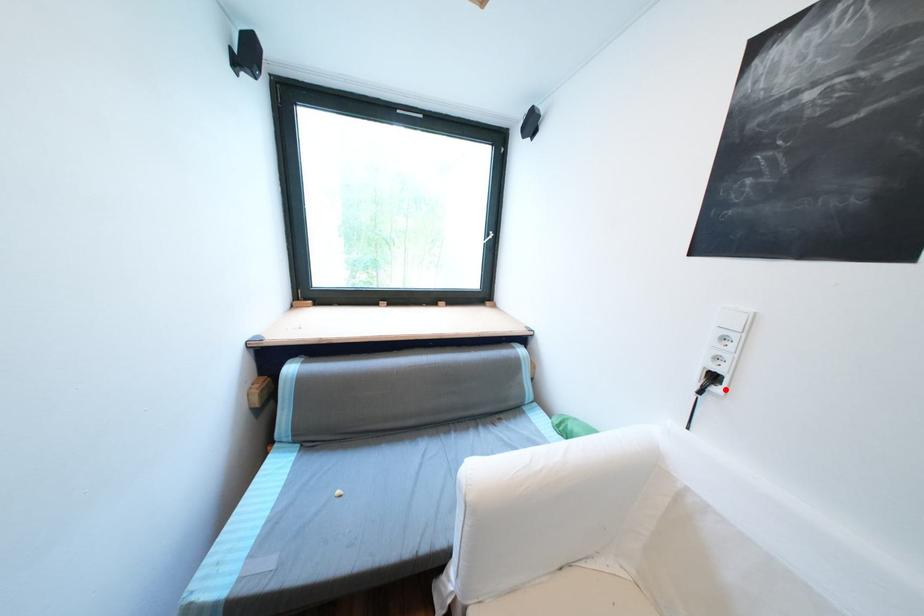
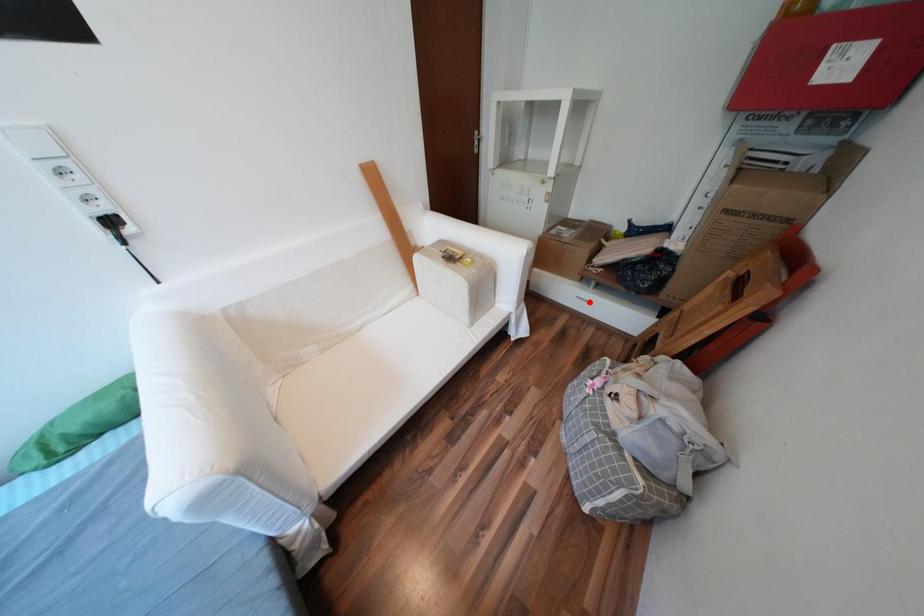
I am providing you with two images of the same scene from different viewpoints. A red point is marked on the first image and another point is marked on the second image. Does the point marked in image1 correspond to the same location as the one in image2?

No